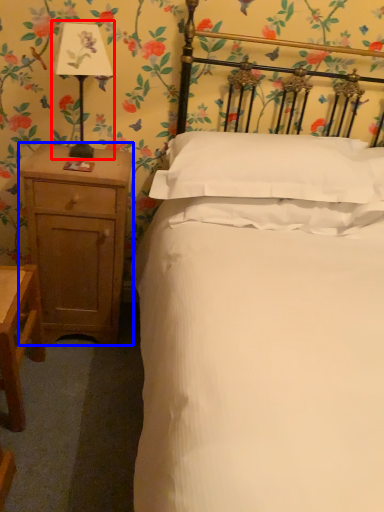
Question: Among these objects, which one is farthest to the camera, bedside lamp (highlighted by a red box) or nightstand (highlighted by a blue box)?

Choices:
 (A) bedside lamp
 (B) nightstand

Answer: (B)